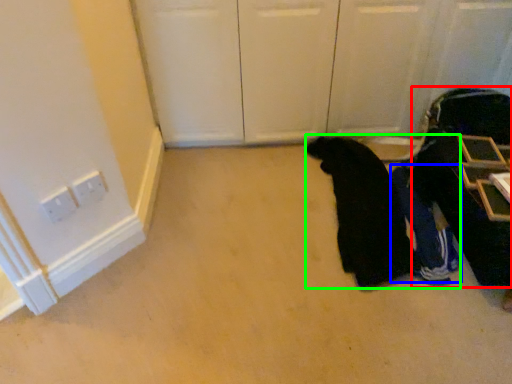
Question: Which is nearer to the luggage (highlighted by a red box)? person (highlighted by a blue box) or person (highlighted by a green box).

Choices:
 (A) person
 (B) person

Answer: (A)